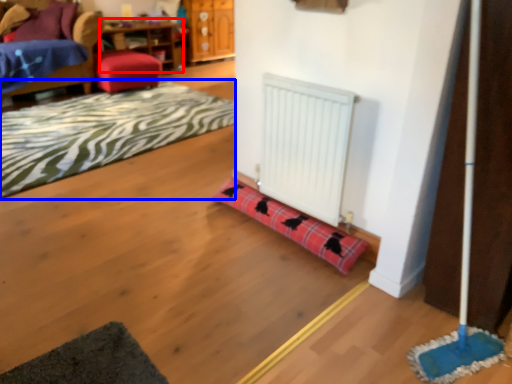
Question: Which object appears farthest to the camera in this image, table (highlighted by a red box) or mat (highlighted by a blue box)?

Choices:
 (A) table
 (B) mat

Answer: (A)